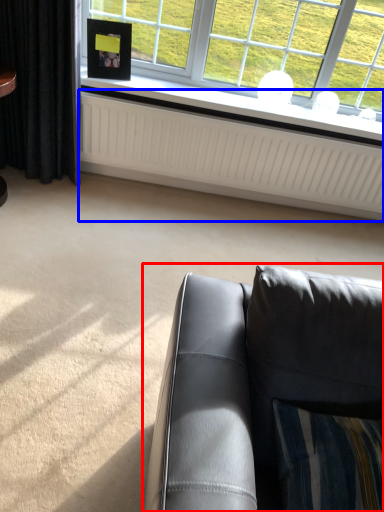
Question: Which object appears closest to the camera in this image, studio couch (highlighted by a red box) or radiator (highlighted by a blue box)?

Choices:
 (A) studio couch
 (B) radiator

Answer: (A)